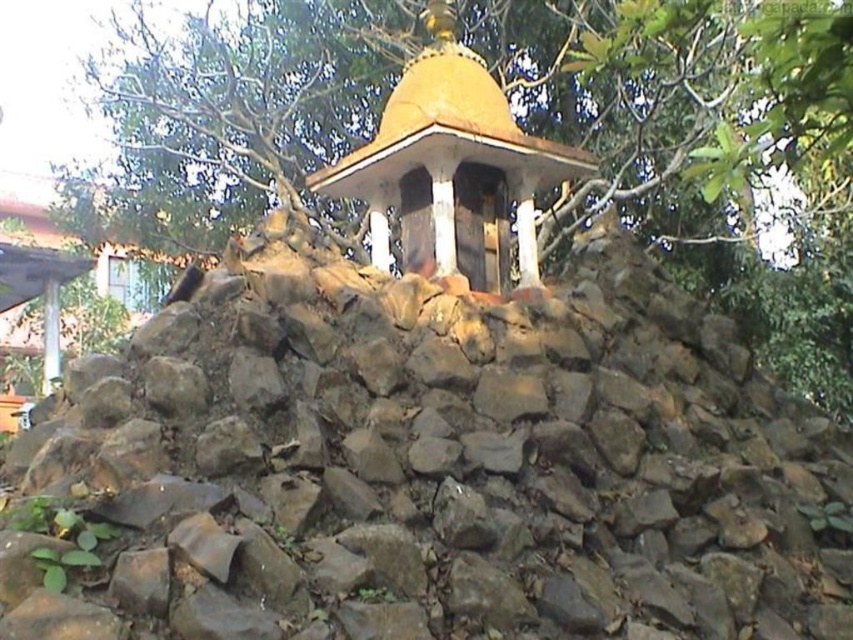
Question: Is the position of brown rough stone at center less distant than that of green leafy tree at upper center?

Choices:
 (A) yes
 (B) no

Answer: (B)

Question: Is brown rough stone at center above green leafy tree at upper center?

Choices:
 (A) yes
 (B) no

Answer: (B)

Question: Which object appears closest to the camera in this image?

Choices:
 (A) brown rough stone at center
 (B) green leafy tree at upper center

Answer: (B)

Question: Which point is farther to the camera?

Choices:
 (A) (834, 10)
 (B) (670, 612)

Answer: (B)

Question: Is brown rough stone at center positioned in front of green leafy tree at upper center?

Choices:
 (A) no
 (B) yes

Answer: (A)